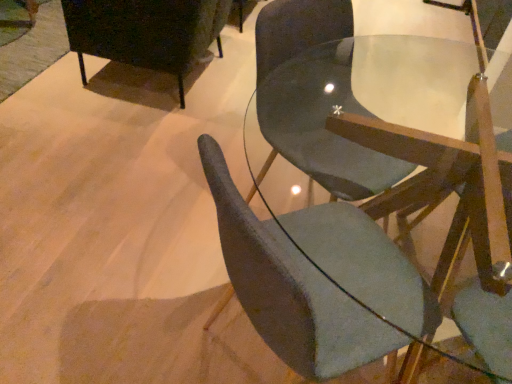
Question: From the image's perspective, is matte black cabinet at upper left, the third chair when ordered from right to left, beneath matte gray chair at center, placed as the third chair when sorted from left to right?

Choices:
 (A) no
 (B) yes

Answer: (A)

Question: Is matte black cabinet at upper left, which is the first chair from left to right, bigger than matte gray chair at center, acting as the first chair starting from the right?

Choices:
 (A) yes
 (B) no

Answer: (B)

Question: Can you confirm if matte black cabinet at upper left, which is the first chair from left to right, is positioned to the left of matte gray chair at center, acting as the first chair starting from the right?

Choices:
 (A) no
 (B) yes

Answer: (B)

Question: Is matte black cabinet at upper left, the third chair when ordered from right to left, not inside matte gray chair at center, acting as the first chair starting from the right?

Choices:
 (A) yes
 (B) no

Answer: (A)

Question: Is matte black cabinet at upper left, the third chair when ordered from right to left, positioned with its back to matte gray chair at center, placed as the third chair when sorted from left to right?

Choices:
 (A) no
 (B) yes

Answer: (A)

Question: In the image, is matte gray chair at center, the 2th chair positioned from the right, on the left side or the right side of matte black cabinet at upper left, which is the first chair from left to right?

Choices:
 (A) right
 (B) left

Answer: (A)

Question: Is matte gray chair at center, the 2th chair in the left-to-right sequence, wider or thinner than matte black cabinet at upper left, which is the first chair from left to right?

Choices:
 (A) thin
 (B) wide

Answer: (A)

Question: Is matte gray chair at center, the 2th chair positioned from the right, in front of or behind matte black cabinet at upper left, the third chair when ordered from right to left, in the image?

Choices:
 (A) behind
 (B) front

Answer: (B)

Question: Is matte gray chair at center, the 2th chair in the left-to-right sequence, bigger or smaller than matte black cabinet at upper left, which is the first chair from left to right?

Choices:
 (A) big
 (B) small

Answer: (B)

Question: Would you say matte black cabinet at upper left, which is the first chair from left to right, is to the left or to the right of matte gray chair at center, the 2th chair in the left-to-right sequence, in the picture?

Choices:
 (A) right
 (B) left

Answer: (B)

Question: Is matte black cabinet at upper left, which is the first chair from left to right, in front of or behind matte gray chair at center, the 2th chair in the left-to-right sequence, in the image?

Choices:
 (A) behind
 (B) front

Answer: (A)

Question: Looking at their shapes, would you say matte black cabinet at upper left, which is the first chair from left to right, is wider or thinner than matte gray chair at center, the 2th chair positioned from the right?

Choices:
 (A) wide
 (B) thin

Answer: (A)

Question: From a real-world perspective, is matte black cabinet at upper left, the third chair when ordered from right to left, physically located above or below matte gray chair at center, the 2th chair positioned from the right?

Choices:
 (A) above
 (B) below

Answer: (B)

Question: Would you say matte black cabinet at upper left, which is the first chair from left to right, is to the left or to the right of matte gray chair at center, placed as the third chair when sorted from left to right, in the picture?

Choices:
 (A) right
 (B) left

Answer: (B)

Question: Considering the positions of point (163, 59) and point (392, 147), is point (163, 59) closer or farther from the camera than point (392, 147)?

Choices:
 (A) closer
 (B) farther

Answer: (B)